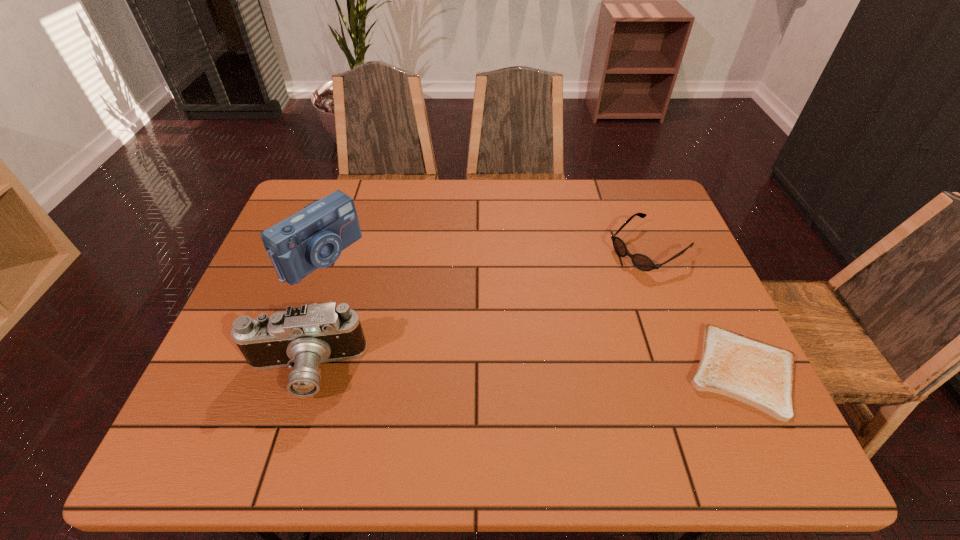
Find the location of `free spot between the nearer camera and the sunglasses`. free spot between the nearer camera and the sunglasses is located at coordinates (477, 309).

You are a GUI agent. You are given a task and a screenshot of the screen. Output one action in this format:
    pyautogui.click(x=<x>, y=<y>)
    Task: Click on the free space between the farther camera and the sunglasses
    The height and width of the screenshot is (540, 960).
    Given the screenshot: What is the action you would take?
    pyautogui.click(x=485, y=252)

Select which object appears as the second closest to the toast. Please provide its 2D coordinates. Your answer should be formatted as a tuple, i.e. [(x, y)], where the tuple contains the x and y coordinates of a point satisfying the conditions above.

[(302, 337)]

Identify which object is the nearest to the nearer camera. Please provide its 2D coordinates. Your answer should be formatted as a tuple, i.e. [(x, y)], where the tuple contains the x and y coordinates of a point satisfying the conditions above.

[(314, 237)]

I want to click on blank area in the image that satisfies the following two spatial constraints: 1. at the lens of the toast; 2. on the left side of the nearer camera, so click(304, 371).

Identify the location of free location that satisfies the following two spatial constraints: 1. at the lens of the shortest object; 2. on the left side of the nearer camera. (304, 371).

Where is `vacant point that satisfies the following two spatial constraints: 1. at the lens of the shortest object; 2. on the right side of the nearer camera`? Image resolution: width=960 pixels, height=540 pixels. vacant point that satisfies the following two spatial constraints: 1. at the lens of the shortest object; 2. on the right side of the nearer camera is located at coordinates (304, 371).